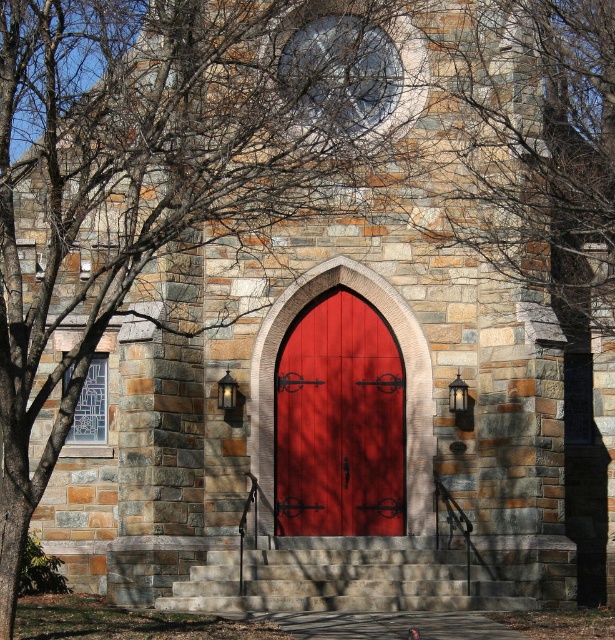
Does matte wood door at center have a greater height compared to stone steps at center?

Indeed, matte wood door at center has a greater height compared to stone steps at center.

Is matte wood door at center to the left of stone steps at center from the viewer's perspective?

Yes, matte wood door at center is to the left of stone steps at center.

Who is more forward, [323,429] or [407,604]?

Point [407,604]

Locate an element on the screen. matte wood door at center is located at coordinates (339, 422).